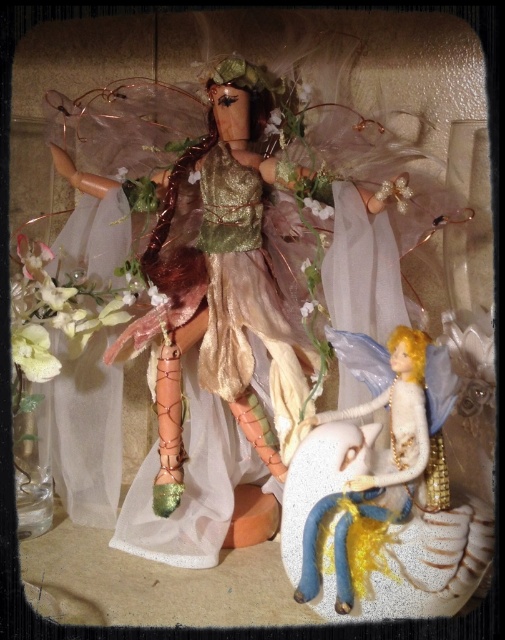
Who is more forward, (178, 545) or (384, 520)?

Point (384, 520) is more forward.

Does point (200, 506) come farther from viewer compared to point (319, 464)?

Yes.

Locate an element on the screen. The height and width of the screenshot is (640, 505). shiny gold fabric dress at center is located at coordinates (190, 484).